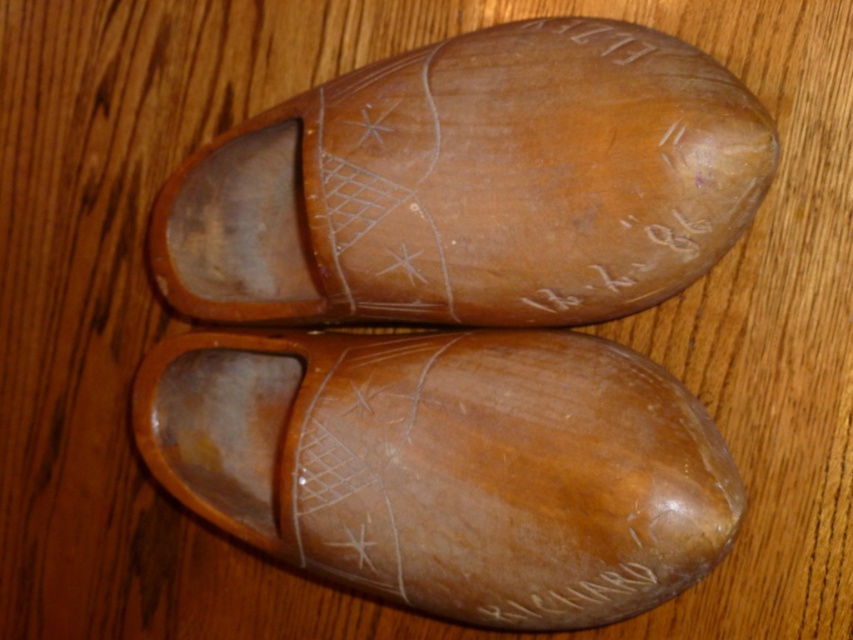
Question: Which object appears closest to the camera in this image?

Choices:
 (A) light brown wood shoe at center
 (B) matte brown wooden shoe at center

Answer: (B)

Question: Among these points, which one is nearest to the camera?

Choices:
 (A) (735, 522)
 (B) (173, 253)

Answer: (A)

Question: Is matte brown wooden shoe at center further to the viewer compared to light brown wood shoe at center?

Choices:
 (A) no
 (B) yes

Answer: (A)

Question: Is matte brown wooden shoe at center closer to the viewer compared to light brown wood shoe at center?

Choices:
 (A) no
 (B) yes

Answer: (B)

Question: Is matte brown wooden shoe at center closer to the viewer compared to light brown wood shoe at center?

Choices:
 (A) no
 (B) yes

Answer: (B)

Question: Which object appears closest to the camera in this image?

Choices:
 (A) matte brown wooden shoe at center
 (B) light brown wood shoe at center

Answer: (A)